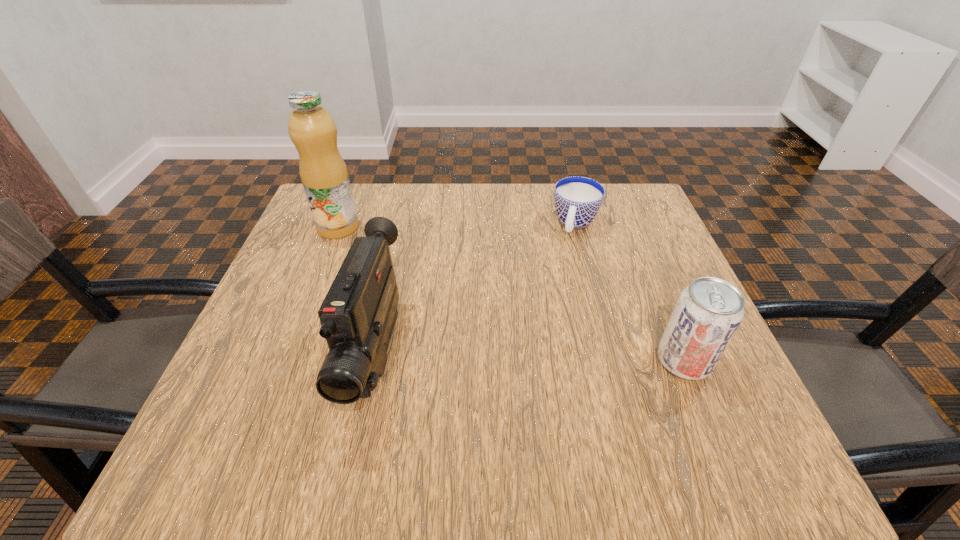
Where is `free point between the second tallest object and the second shortest object`? This screenshot has width=960, height=540. free point between the second tallest object and the second shortest object is located at coordinates (530, 357).

Locate an element on the screen. This screenshot has height=540, width=960. object that stands as the closest to the rightmost object is located at coordinates pos(577,199).

You are a GUI agent. You are given a task and a screenshot of the screen. Output one action in this format:
    pyautogui.click(x=<x>, y=<y>)
    Task: Click on the object that can be found as the third closest to the second object from left to right
    This screenshot has width=960, height=540.
    Given the screenshot: What is the action you would take?
    pyautogui.click(x=708, y=312)

Identify the location of free spot that satisfies the following two spatial constraints: 1. on the front side of the third tallest object; 2. on the right side of the leftmost object. This screenshot has height=540, width=960. (286, 360).

Find the location of `vacant region that satisfies the following two spatial constraints: 1. on the front-facing side of the rightmost object; 2. on the right side of the second tallest object`. vacant region that satisfies the following two spatial constraints: 1. on the front-facing side of the rightmost object; 2. on the right side of the second tallest object is located at coordinates (374, 360).

Image resolution: width=960 pixels, height=540 pixels. I want to click on free spot that satisfies the following two spatial constraints: 1. on the front-facing side of the second tallest object; 2. on the right side of the rightmost object, so click(374, 360).